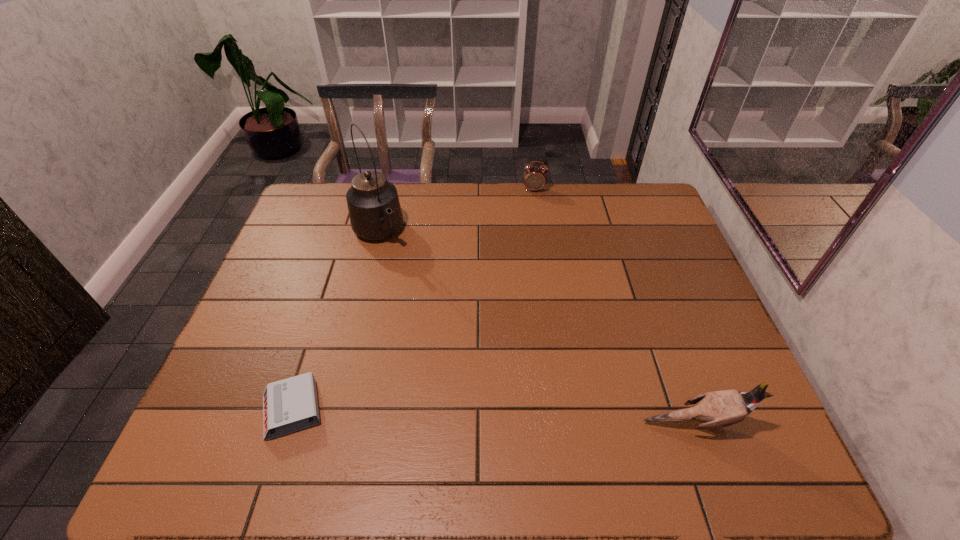
The image size is (960, 540). In order to click on free space on the desktop that is between the left alarm clock and the bird and is positioned on the face of the second shortest object in this screenshot , I will do `click(541, 418)`.

Where is `vacant spot on the desktop that is between the shortest object and the rightmost object and is positioned spout on the tallest object`? The image size is (960, 540). vacant spot on the desktop that is between the shortest object and the rightmost object and is positioned spout on the tallest object is located at coordinates (510, 417).